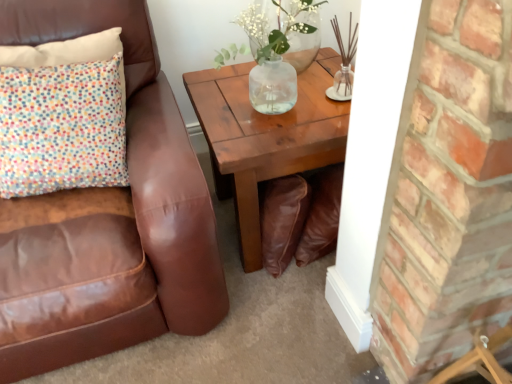
Describe the element at coordinates (61, 128) in the screenshot. I see `multicolored fabric pillow at upper left` at that location.

I want to click on wooden coffee table at center, so click(x=263, y=139).

Describe the element at coordinates (108, 220) in the screenshot. I see `brown leather chair at left` at that location.

The image size is (512, 384). What are the coordinates of `multicolored fabric pillow at upper left` in the screenshot? It's located at (61, 128).

From the image's perspective, is multicolored fabric pillow at upper left beneath clear glass vase at upper center?

Correct, multicolored fabric pillow at upper left appears lower than clear glass vase at upper center in the image.

Which point is more distant from viewer, (16, 182) or (280, 16)?

The point (280, 16) is behind.

What's the angular difference between multicolored fabric pillow at upper left and clear glass vase at upper center's facing directions?

They differ by 3.18 degrees in their facing directions.

Is multicolored fabric pillow at upper left at the right side of clear glass vase at upper center?

In fact, multicolored fabric pillow at upper left is to the left of clear glass vase at upper center.

How far apart are brown leather chair at left and clear glass vase at upper center?

brown leather chair at left and clear glass vase at upper center are 22.77 inches apart.

Which of these two, brown leather chair at left or clear glass vase at upper center, stands taller?

Standing taller between the two is brown leather chair at left.

Which object is wider, brown leather chair at left or clear glass vase at upper center?

brown leather chair at left is wider.

From the image's perspective, is brown leather chair at left positioned above or below clear glass vase at upper center?

Clearly, from the image's perspective, brown leather chair at left is below clear glass vase at upper center.

The width and height of the screenshot is (512, 384). Find the location of `coffee table above the brown leather chair at left (from the image's perspective)`. coffee table above the brown leather chair at left (from the image's perspective) is located at coordinates (263, 139).

From a real-world perspective, relative to brown leather chair at left, is wooden coffee table at center vertically above or below?

wooden coffee table at center is below brown leather chair at left.

Is point (238, 220) positioned before point (126, 272)?

That is False.

Between wooden coffee table at center and brown leather chair at left, which one has smaller width?

wooden coffee table at center.

From a real-world perspective, is multicolored fabric pillow at upper left above or below wooden coffee table at center?

In terms of real-world spatial position, multicolored fabric pillow at upper left is above wooden coffee table at center.

Is multicolored fabric pillow at upper left to the right of wooden coffee table at center from the viewer's perspective?

In fact, multicolored fabric pillow at upper left is to the left of wooden coffee table at center.

At what (x,y) coordinates should I click in order to perform the action: click on coffee table that is under the multicolored fabric pillow at upper left (from a real-world perspective). Please return your answer as a coordinate pair (x, y). The image size is (512, 384). Looking at the image, I should click on (263, 139).

Who is taller, multicolored fabric pillow at upper left or wooden coffee table at center?

wooden coffee table at center is taller.

Is clear glass vase at upper center not close to brown leather chair at left?

Actually, clear glass vase at upper center and brown leather chair at left are a little close together.

The height and width of the screenshot is (384, 512). In order to click on chair in front of the clear glass vase at upper center in this screenshot , I will do `click(108, 220)`.

Does clear glass vase at upper center have a lesser width compared to brown leather chair at left?

Yes.

In the scene shown: Is clear glass vase at upper center not within brown leather chair at left?

That's correct, clear glass vase at upper center is outside of brown leather chair at left.

How many degrees apart are the facing directions of brown leather chair at left and wooden coffee table at center?

2.17 degrees separate the facing orientations of brown leather chair at left and wooden coffee table at center.

Locate an element on the screen. This screenshot has height=384, width=512. chair on the left of wooden coffee table at center is located at coordinates (108, 220).

Is brown leather chair at left not near wooden coffee table at center?

No, brown leather chair at left is in close proximity to wooden coffee table at center.

Can you confirm if brown leather chair at left is positioned to the right of wooden coffee table at center?

Incorrect, brown leather chair at left is not on the right side of wooden coffee table at center.

From the picture: Considering the relative positions of wooden coffee table at center and multicolored fabric pillow at upper left in the image provided, is wooden coffee table at center behind multicolored fabric pillow at upper left?

Yes, wooden coffee table at center is further from the viewer.

Considering the relative sizes of wooden coffee table at center and multicolored fabric pillow at upper left in the image provided, is wooden coffee table at center wider than multicolored fabric pillow at upper left?

Yes, wooden coffee table at center is wider than multicolored fabric pillow at upper left.

Is wooden coffee table at center spatially inside multicolored fabric pillow at upper left, or outside of it?

wooden coffee table at center is not enclosed by multicolored fabric pillow at upper left.

From a real-world perspective, relative to multicolored fabric pillow at upper left, is wooden coffee table at center vertically above or below?

wooden coffee table at center is situated lower than multicolored fabric pillow at upper left in the real world.

At what (x,y) coordinates should I click in order to perform the action: click on pillow in front of the clear glass vase at upper center. Please return your answer as a coordinate pair (x, y). This screenshot has width=512, height=384. Looking at the image, I should click on (61, 128).

The height and width of the screenshot is (384, 512). What are the coordinates of `chair below the clear glass vase at upper center (from a real-world perspective)` in the screenshot? It's located at (108, 220).

Looking at this image, estimate the real-world distances between objects in this image. Which object is closer to clear glass vase at upper center, brown leather chair at left or wooden coffee table at center?

wooden coffee table at center lies closer to clear glass vase at upper center than the other object.

Looking at the image, which one is located further to wooden coffee table at center, clear glass vase at upper center or multicolored fabric pillow at upper left?

multicolored fabric pillow at upper left is further to wooden coffee table at center.

Estimate the real-world distances between objects in this image. Which object is further from brown leather chair at left, multicolored fabric pillow at upper left or clear glass vase at upper center?

clear glass vase at upper center lies further to brown leather chair at left than the other object.

Looking at the image, which one is located closer to clear glass vase at upper center, multicolored fabric pillow at upper left or wooden coffee table at center?

Among the two, wooden coffee table at center is located nearer to clear glass vase at upper center.

Looking at the image, which one is located closer to clear glass vase at upper center, brown leather chair at left or multicolored fabric pillow at upper left?

multicolored fabric pillow at upper left is positioned closer to the anchor clear glass vase at upper center.

Considering their positions, is brown leather chair at left positioned further to wooden coffee table at center than multicolored fabric pillow at upper left?

Based on the image, multicolored fabric pillow at upper left appears to be further to wooden coffee table at center.

Looking at the image, which one is located further to multicolored fabric pillow at upper left, brown leather chair at left or clear glass vase at upper center?

clear glass vase at upper center lies further to multicolored fabric pillow at upper left than the other object.

Considering their positions, is multicolored fabric pillow at upper left positioned closer to wooden coffee table at center than brown leather chair at left?

brown leather chair at left lies closer to wooden coffee table at center than the other object.

At what (x,y) coordinates should I click in order to perform the action: click on floral arrangement between multicolored fabric pillow at upper left and wooden coffee table at center. Please return your answer as a coordinate pair (x, y). The height and width of the screenshot is (384, 512). Looking at the image, I should click on (282, 30).

Find the location of a particular element. This screenshot has height=384, width=512. pillow located between brown leather chair at left and wooden coffee table at center in the left-right direction is located at coordinates (61, 128).

Identify the location of pillow between brown leather chair at left and clear glass vase at upper center from left to right. (61, 128).

Find the location of `floral arrangement between brown leather chair at left and wooden coffee table at center from left to right`. floral arrangement between brown leather chair at left and wooden coffee table at center from left to right is located at coordinates [282, 30].